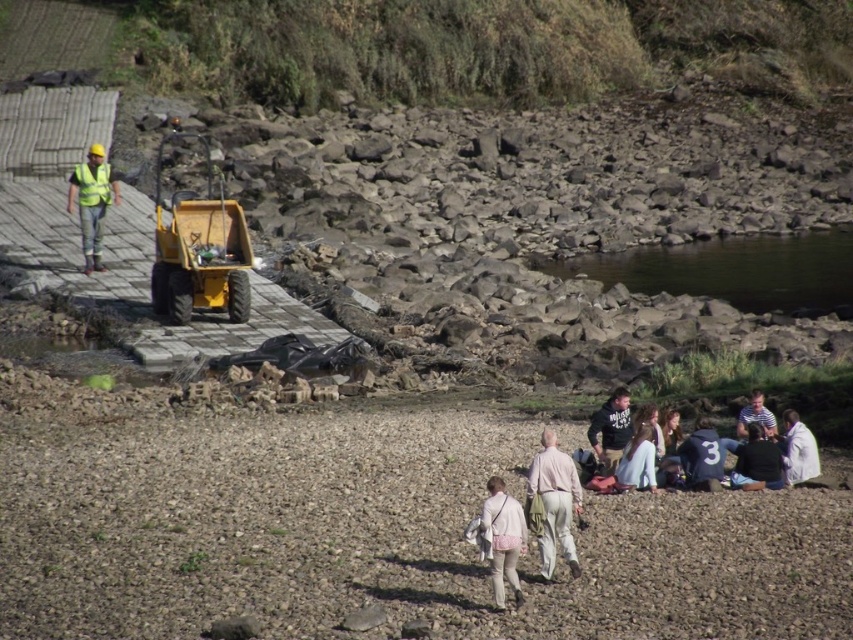
Is yellow rubber excavator at center positioned before light beige cotton pants at center?

No, it is behind light beige cotton pants at center.

Is point (207, 296) less distant than point (555, 444)?

No, it is behind (555, 444).

I want to click on yellow rubber excavator at center, so click(199, 250).

Does point (207, 205) come closer to viewer compared to point (628, 426)?

No, (207, 205) is behind (628, 426).

Does yellow rubber excavator at center appear on the left side of dark gray hoodie at lower right?

Indeed, yellow rubber excavator at center is positioned on the left side of dark gray hoodie at lower right.

Where is `yellow rubber excavator at center`? This screenshot has width=853, height=640. yellow rubber excavator at center is located at coordinates (199, 250).

You are a GUI agent. You are given a task and a screenshot of the screen. Output one action in this format:
    pyautogui.click(x=<x>, y=<y>)
    Task: Click on the yellow rubber excavator at center
    The image size is (853, 640).
    Given the screenshot: What is the action you would take?
    pyautogui.click(x=199, y=250)

Does dark gray hoodie at lower right lie behind reflective yellow safety vest at left?

That is False.

Is dark gray hoodie at lower right to the right of reflective yellow safety vest at left from the viewer's perspective?

Indeed, dark gray hoodie at lower right is positioned on the right side of reflective yellow safety vest at left.

Does point (625, 410) lie behind point (103, 198)?

No, it is in front of (103, 198).

The width and height of the screenshot is (853, 640). What are the coordinates of `dark gray hoodie at lower right` in the screenshot? It's located at (611, 429).